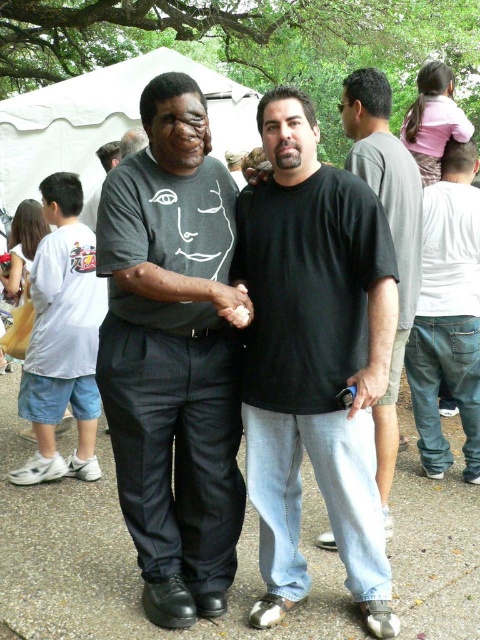
You are a photographer at the event and want to capture both the black matte shirt at center and the white fabric tent at upper center in the same frame. Which object will appear smaller in the photo?

The black matte shirt at center will appear smaller in the photo because it has a lesser height compared to the white fabric tent at upper center.

You are standing at the edge of the scene and want to take a photo of the black matte shirt at center and the gray concrete pavement at center. Which object should you focus on first if you want to capture both clearly in your photo?

The black matte shirt at center is located above the gray concrete pavement at center, so you should focus on the black matte shirt at center first to ensure both are in focus.